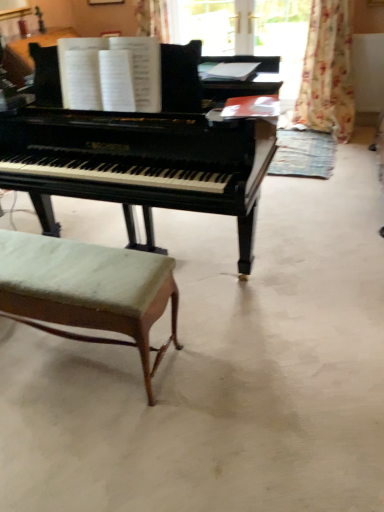
In order to click on free space above green fabric stool at lower left (from a real-world perspective) in this screenshot , I will do `click(66, 265)`.